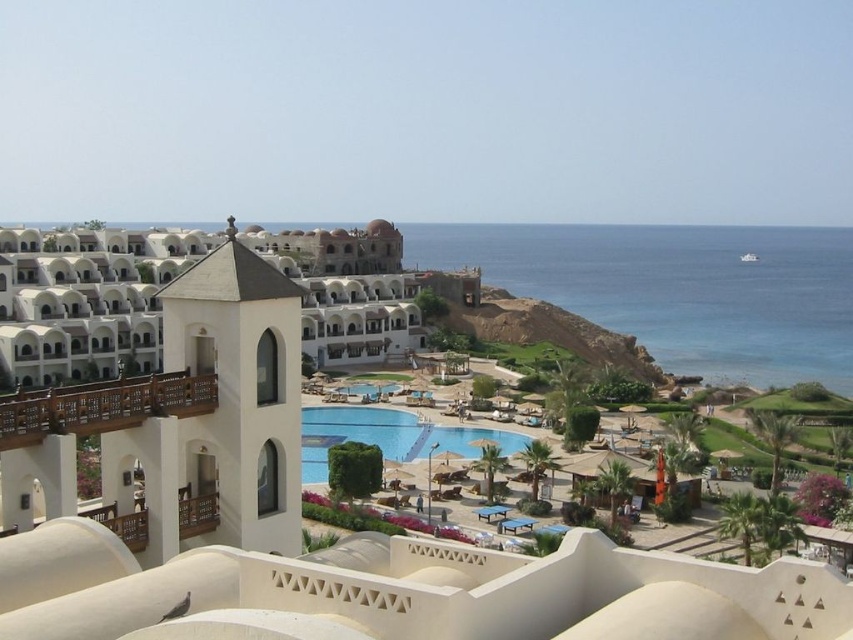
You are standing at the point marked by the coordinates point [329,548] in the image. What architectural feature can you see directly in front of you?

The point [329,548] marks the white matte building at center, so you can see the white matte building at center directly in front of you.

You are a guest staying at the resort and want to take a photo of the white matte building at center from the wooden balcony at upper left. Will the entire building fit in your camera frame if you stand on the balcony?

The white matte building at center is much taller than the wooden balcony at upper left, so the entire building may not fit in the camera frame from the balcony.

You are standing at the entrance of the resort and want to take a photo of the wooden balcony at upper left and the blue glossy pool at center. Which object will appear closer to you in the photo?

The wooden balcony at upper left will appear closer to you in the photo because it is positioned in front of the blue glossy pool at center.